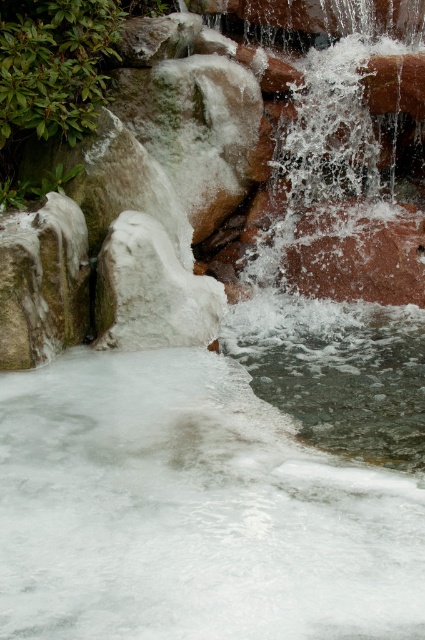
Question: Which point is farther from the camera taking this photo?

Choices:
 (A) (42, 360)
 (B) (189, 314)

Answer: (B)

Question: Among these objects, which one is farthest from the camera?

Choices:
 (A) white frosty rock at center
 (B) white frosty rock at left

Answer: (A)

Question: Does white frosty rock at left come behind white frosty rock at center?

Choices:
 (A) yes
 (B) no

Answer: (B)

Question: From the image, what is the correct spatial relationship of white frosty rock at left in relation to white frosty rock at center?

Choices:
 (A) left
 (B) right

Answer: (A)

Question: Is white frosty rock at left to the right of white frosty rock at center from the viewer's perspective?

Choices:
 (A) no
 (B) yes

Answer: (A)

Question: Which of the following is the farthest from the observer?

Choices:
 (A) pos(28,332)
 (B) pos(110,232)

Answer: (B)